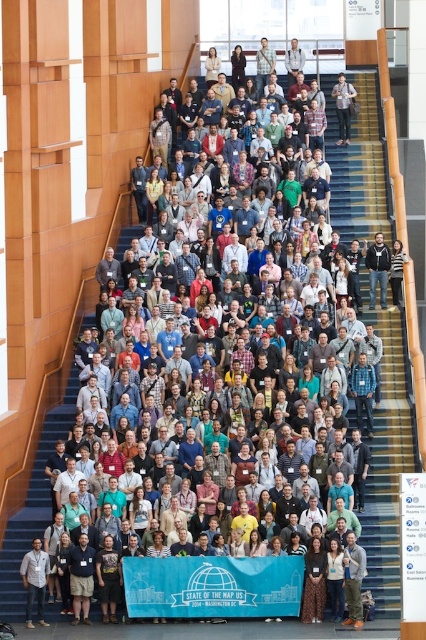
You are organizing a photo shoot and need to ensure that the matte black backpack at upper center and the matte black jacket at center are both visible in the frame. Given their sizes, which object might require more space in the composition?

The matte black backpack at upper center requires more space in the composition because its width is larger than the matte black jacket at center.

You are standing at the bottom of the staircase and see the matte black backpack at upper center and the matte black jacket at center. Which item is higher up the staircase?

The matte black backpack at upper center is higher up the staircase than the matte black jacket at center because it is positioned above it.